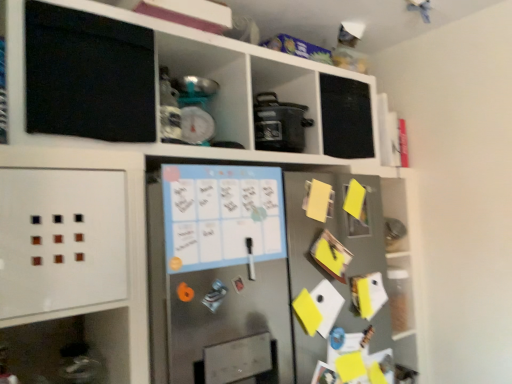
I want to click on stainless steel fridge at center, so click(259, 275).

Which of these two, stainless steel fridge at center or yellow paper at right, stands taller?

Standing taller between the two is stainless steel fridge at center.

Where is `note on the right of stainless steel fridge at center`? Image resolution: width=512 pixels, height=384 pixels. note on the right of stainless steel fridge at center is located at coordinates (318, 200).

Which object is more forward, stainless steel fridge at center or yellow paper at right?

stainless steel fridge at center is in front.

Looking at the image, does stainless steel fridge at center seem bigger or smaller compared to yellow paper at right?

stainless steel fridge at center is bigger than yellow paper at right.

Considering the sizes of matte black pot at center and stainless steel fridge at center in the image, is matte black pot at center taller or shorter than stainless steel fridge at center?

In the image, matte black pot at center appears to be shorter than stainless steel fridge at center.

From the image's perspective, is matte black pot at center positioned above or below stainless steel fridge at center?

matte black pot at center is situated higher than stainless steel fridge at center in the image.

Where is `fridge located on the left of matte black pot at center`? This screenshot has width=512, height=384. fridge located on the left of matte black pot at center is located at coordinates (259, 275).

Between yellow paper at right and stainless steel fridge at center, which one has more height?

Standing taller between the two is stainless steel fridge at center.

From the image's perspective, is yellow paper at right positioned above or below stainless steel fridge at center?

yellow paper at right is above stainless steel fridge at center.

Does yellow paper at right turn towards stainless steel fridge at center?

Yes, yellow paper at right is aimed at stainless steel fridge at center.

Is yellow paper at right far away from stainless steel fridge at center?

No, yellow paper at right is not far away from stainless steel fridge at center.

Is yellow paper at right aimed at matte black pot at center?

No, yellow paper at right is not turned towards matte black pot at center.

Which object is positioned more to the right, yellow paper at right or matte black pot at center?

yellow paper at right.

Which object is more forward, yellow paper at right or matte black pot at center?

yellow paper at right is more forward.

Is stainless steel fridge at center completely or partially outside of matte black pot at center?

Yes.

Is stainless steel fridge at center oriented towards matte black pot at center?

No, stainless steel fridge at center does not turn towards matte black pot at center.

Are stainless steel fridge at center and matte black pot at center beside each other?

stainless steel fridge at center and matte black pot at center are not in contact.

Is stainless steel fridge at center taller than matte black pot at center?

Indeed, stainless steel fridge at center has a greater height compared to matte black pot at center.

Can you tell me how much matte black pot at center and yellow paper at right differ in facing direction?

2.4 degrees separate the facing orientations of matte black pot at center and yellow paper at right.

Who is taller, matte black pot at center or yellow paper at right?

matte black pot at center.

Is there a large distance between matte black pot at center and yellow paper at right?

No, matte black pot at center is not far away from yellow paper at right.

Find the location of a particular element. fridge that is under the yellow paper at right (from a real-world perspective) is located at coordinates [x=259, y=275].

You are a GUI agent. You are given a task and a screenshot of the screen. Output one action in this format:
    pyautogui.click(x=<x>, y=<y>)
    Task: Click on the fridge that is below the matte black pot at center (from the image's perspective)
    This screenshot has height=384, width=512.
    Given the screenshot: What is the action you would take?
    pyautogui.click(x=259, y=275)

Looking at the image, which one is located closer to stainless steel fridge at center, matte black pot at center or yellow paper at right?

Among the two, yellow paper at right is located nearer to stainless steel fridge at center.

Based on their spatial positions, is stainless steel fridge at center or matte black pot at center closer to yellow paper at right?

matte black pot at center is positioned closer to the anchor yellow paper at right.

Considering their positions, is yellow paper at right positioned further to stainless steel fridge at center than matte black pot at center?

The object further to stainless steel fridge at center is matte black pot at center.

Based on their spatial positions, is yellow paper at right or stainless steel fridge at center further from matte black pot at center?

stainless steel fridge at center.

Which object lies further to the anchor point yellow paper at right, matte black pot at center or stainless steel fridge at center?

Among the two, stainless steel fridge at center is located further to yellow paper at right.

Considering their positions, is stainless steel fridge at center positioned further to matte black pot at center than yellow paper at right?

stainless steel fridge at center is further to matte black pot at center.

The width and height of the screenshot is (512, 384). Identify the location of note between matte black pot at center and stainless steel fridge at center from top to bottom. (318, 200).